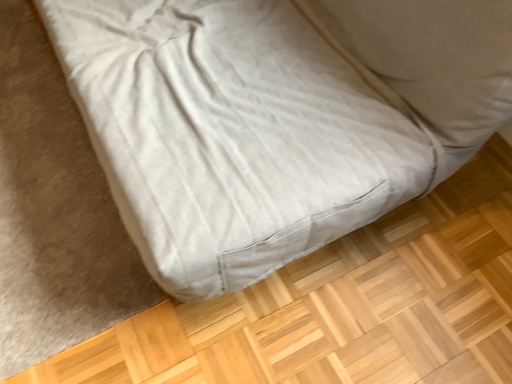
Measure the distance between point (357, 67) and camera.

3.76 feet.

Describe the element at coordinates (275, 119) in the screenshot. I see `white fabric bed at center` at that location.

You are a GUI agent. You are given a task and a screenshot of the screen. Output one action in this format:
    pyautogui.click(x=<x>, y=<y>)
    Task: Click on the white fabric bed at center
    The width and height of the screenshot is (512, 384).
    Given the screenshot: What is the action you would take?
    pyautogui.click(x=275, y=119)

Where is `white fabric bed at center`? The image size is (512, 384). white fabric bed at center is located at coordinates (275, 119).